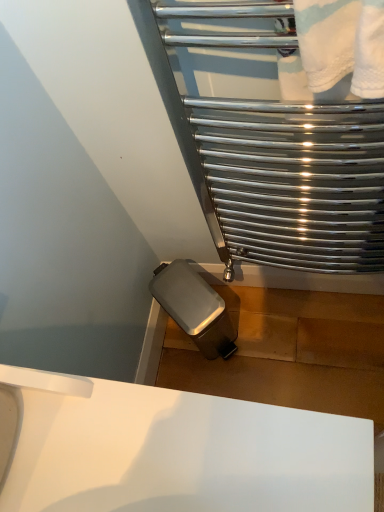
Question: Is point (279, 493) positioned closer to the camera than point (296, 212)?

Choices:
 (A) farther
 (B) closer

Answer: (B)

Question: Which is correct: white glossy sink at lower center is inside polished chrome towel rack at upper right, or outside of it?

Choices:
 (A) outside
 (B) inside

Answer: (A)

Question: Would you say white glossy sink at lower center is to the left or to the right of polished chrome towel rack at upper right in the picture?

Choices:
 (A) left
 (B) right

Answer: (A)

Question: Is polished chrome towel rack at upper right inside the boundaries of white glossy sink at lower center, or outside?

Choices:
 (A) inside
 (B) outside

Answer: (B)

Question: Is polished chrome towel rack at upper right bigger or smaller than white glossy sink at lower center?

Choices:
 (A) small
 (B) big

Answer: (A)

Question: Is polished chrome towel rack at upper right to the left or to the right of white glossy sink at lower center in the image?

Choices:
 (A) left
 (B) right

Answer: (B)

Question: In terms of height, does polished chrome towel rack at upper right look taller or shorter compared to white glossy sink at lower center?

Choices:
 (A) tall
 (B) short

Answer: (A)